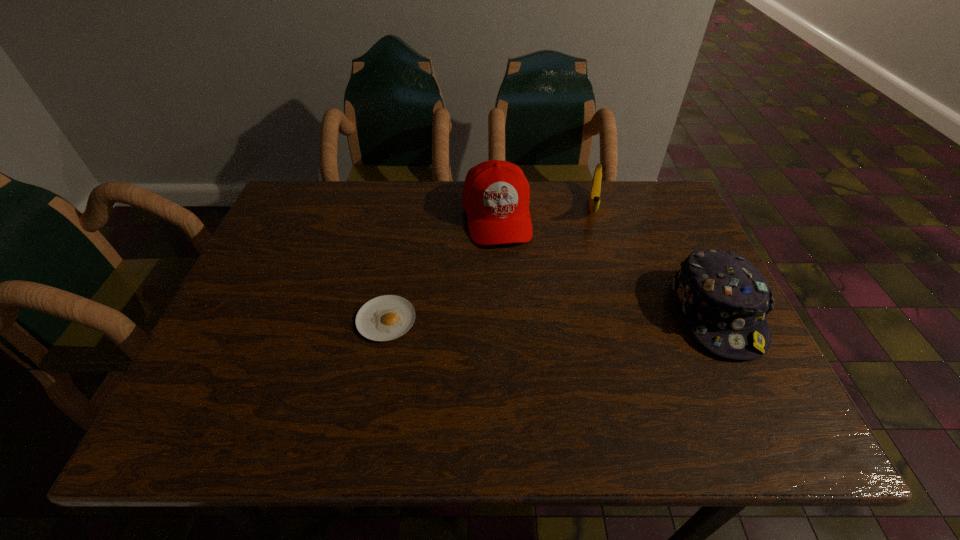
Image resolution: width=960 pixels, height=540 pixels. I want to click on the shortest object, so click(384, 318).

The height and width of the screenshot is (540, 960). Identify the location of egg yolk. pyautogui.click(x=384, y=318).

Find the location of a particular element. headwear is located at coordinates (725, 299).

The width and height of the screenshot is (960, 540). What are the coordinates of `the third shortest object` in the screenshot? It's located at [x=725, y=299].

At what (x,y) coordinates should I click in order to perform the action: click on the tallest object. Please return your answer as a coordinate pair (x, y). The image size is (960, 540). Looking at the image, I should click on (496, 193).

This screenshot has width=960, height=540. I want to click on the second object from left to right, so click(496, 193).

The width and height of the screenshot is (960, 540). What are the coordinates of `the second shortest object` in the screenshot? It's located at (594, 201).

Where is `the third object from left to right`? This screenshot has height=540, width=960. the third object from left to right is located at coordinates (594, 201).

This screenshot has height=540, width=960. Identify the location of vacant space located 0.290m on the left of the leftmost object. (228, 320).

Locate an element on the screen. This screenshot has height=540, width=960. free spot located on the front-facing side of the second tallest object is located at coordinates pos(757,398).